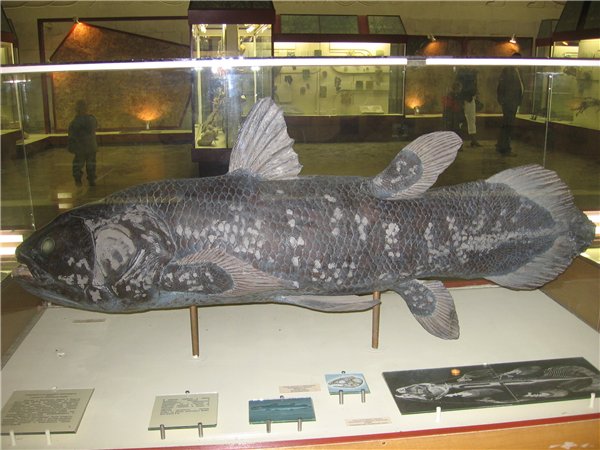
Where is `glass`? The image size is (600, 450). glass is located at coordinates (122, 147), (360, 137), (480, 118), (571, 140).